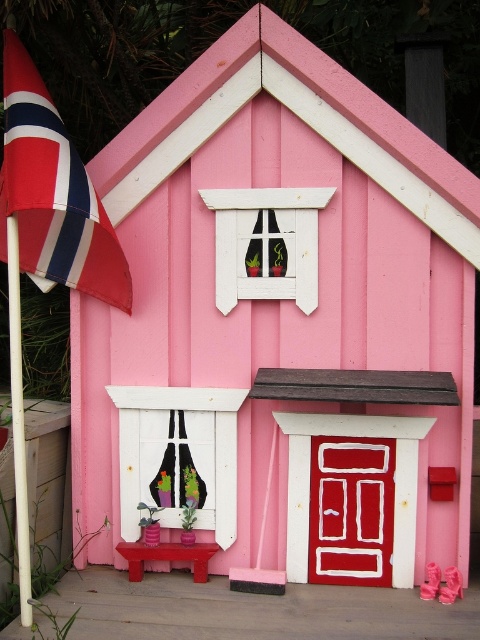
Can you confirm if red and white striped flag at left is bigger than matte pink shoes at lower right?

Indeed, red and white striped flag at left has a larger size compared to matte pink shoes at lower right.

Can you confirm if red and white striped flag at left is taller than matte pink shoes at lower right?

Indeed, red and white striped flag at left has a greater height compared to matte pink shoes at lower right.

Describe the element at coordinates (52, 193) in the screenshot. The image size is (480, 640). I see `red and white striped flag at left` at that location.

At what (x,y) coordinates should I click in order to perform the action: click on red and white striped flag at left. Please return your answer as a coordinate pair (x, y). Looking at the image, I should click on (52, 193).

Between red and white striped flag at left and pink matte flower pot at lower center, which one is positioned lower?

pink matte flower pot at lower center is lower down.

Image resolution: width=480 pixels, height=640 pixels. Describe the element at coordinates (52, 193) in the screenshot. I see `red and white striped flag at left` at that location.

You are a GUI agent. You are given a task and a screenshot of the screen. Output one action in this format:
    pyautogui.click(x=<x>, y=<y>)
    Task: Click on the red and white striped flag at left
    
    Given the screenshot: What is the action you would take?
    pyautogui.click(x=52, y=193)

Who is positioned more to the left, matte pink shoes at lower right or pink matte flower pot at lower center?

Positioned to the left is pink matte flower pot at lower center.

Does point (443, 586) come behind point (429, 579)?

No, (443, 586) is in front of (429, 579).

What are the coordinates of `matte pink shoes at lower right` in the screenshot? It's located at (451, 586).